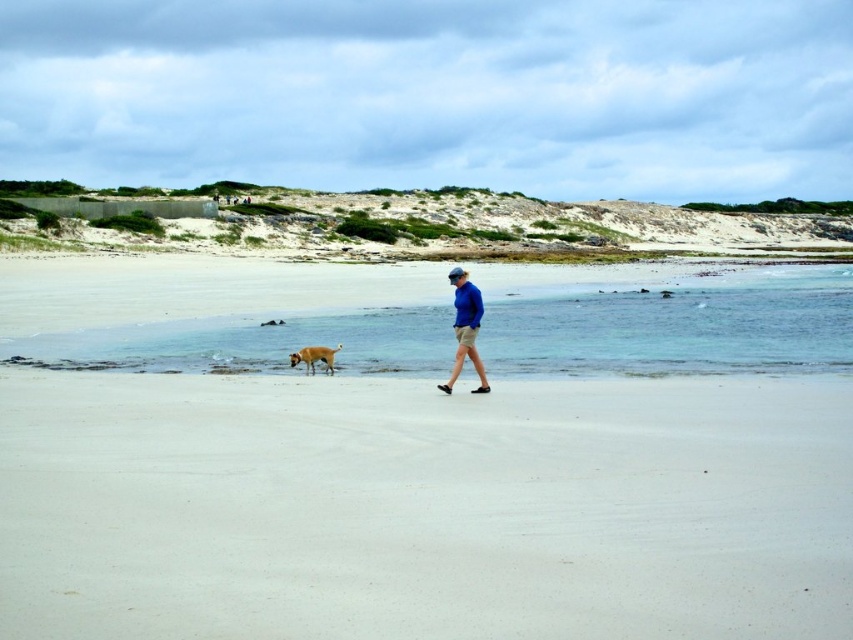
You are standing on the beach and want to take a photo of the white sand at center. Where exactly should you aim your camera to capture it?

You should aim your camera at point coordinates (422,508) to capture the white sand at center.

You are standing on the beach and see the white sand at center and the blue cotton shirt at center. Which object is wider?

The white sand at center is wider than the blue cotton shirt at center.

You are standing on the beach and see the white sand at center and the blue cotton shirt at center. If you want to reach the water, which one should you walk towards?

You should walk towards the white sand at center because it is farther away from the blue cotton shirt at center by 6.74 meters, indicating it is closer to the water.